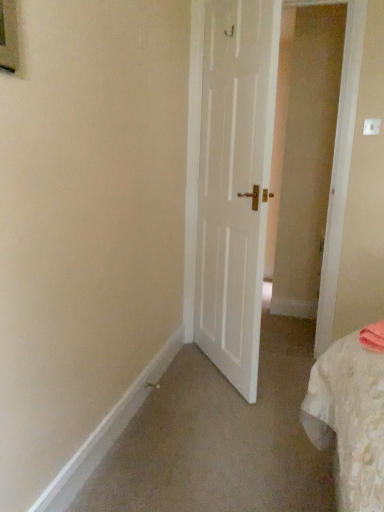
Describe the element at coordinates (371, 127) in the screenshot. The height and width of the screenshot is (512, 384). I see `white plastic electric outlet at upper right` at that location.

The image size is (384, 512). I want to click on white plastic electric outlet at upper right, so click(x=371, y=127).

At what (x,y) coordinates should I click in order to perform the action: click on white matte door at center. Please return your answer as a coordinate pair (x, y). Looking at the image, I should click on (235, 183).

What is the approximate height of white matte door at center?

6.59 feet.

The width and height of the screenshot is (384, 512). What do you see at coordinates (235, 183) in the screenshot?
I see `white matte door at center` at bounding box center [235, 183].

Locate an element on the screen. white plastic electric outlet at upper right is located at coordinates (371, 127).

Between white matte door at center and white plastic electric outlet at upper right, which one appears on the left side from the viewer's perspective?

Positioned to the left is white matte door at center.

From the picture: Considering the relative positions of white matte door at center and white plastic electric outlet at upper right in the image provided, is white matte door at center in front of white plastic electric outlet at upper right?

Yes, white matte door at center is closer to the camera.

Considering the points (261, 106) and (379, 127), which point is behind, point (261, 106) or point (379, 127)?

The point (379, 127) is more distant.

From the image's perspective, which object appears higher, white matte door at center or white plastic electric outlet at upper right?

white plastic electric outlet at upper right is shown above in the image.

From a real-world perspective, which is physically below, white matte door at center or white plastic electric outlet at upper right?

white matte door at center, from a real-world perspective.

Looking at their sizes, would you say white matte door at center is wider or thinner than white plastic electric outlet at upper right?

white matte door at center is wider than white plastic electric outlet at upper right.

Does white matte door at center have a lesser height compared to white plastic electric outlet at upper right?

No, white matte door at center is not shorter than white plastic electric outlet at upper right.

In terms of size, does white matte door at center appear bigger or smaller than white plastic electric outlet at upper right?

Clearly, white matte door at center is larger in size than white plastic electric outlet at upper right.

Is white plastic electric outlet at upper right completely or partially inside white matte door at center?

No, white matte door at center does not contain white plastic electric outlet at upper right.

Is white matte door at center with white plastic electric outlet at upper right?

No, white matte door at center is not making contact with white plastic electric outlet at upper right.

Is white matte door at center looking in the opposite direction of white plastic electric outlet at upper right?

That's right, white matte door at center is facing away from white plastic electric outlet at upper right.

Where is `electric outlet above the white matte door at center (from the image's perspective)`? electric outlet above the white matte door at center (from the image's perspective) is located at coordinates (371, 127).

Does white plastic electric outlet at upper right appear on the left side of white matte door at center?

In fact, white plastic electric outlet at upper right is to the right of white matte door at center.

Based on the photo, considering their positions, is white plastic electric outlet at upper right located in front of or behind white matte door at center?

white plastic electric outlet at upper right is behind white matte door at center.

Considering the positions of point (379, 129) and point (243, 66), is point (379, 129) closer or farther from the camera than point (243, 66)?

Point (379, 129) is farther from the camera than point (243, 66).

From the image's perspective, which is above, white plastic electric outlet at upper right or white matte door at center?

white plastic electric outlet at upper right is shown above in the image.

From a real-world perspective, is white plastic electric outlet at upper right physically located above or below white matte door at center?

From a real-world perspective, white plastic electric outlet at upper right is physically above white matte door at center.

Does white plastic electric outlet at upper right have a lesser width compared to white matte door at center?

Indeed, white plastic electric outlet at upper right has a lesser width compared to white matte door at center.

Is white plastic electric outlet at upper right shorter than white matte door at center?

Indeed, white plastic electric outlet at upper right has a lesser height compared to white matte door at center.

Considering the relative sizes of white plastic electric outlet at upper right and white matte door at center in the image provided, is white plastic electric outlet at upper right smaller than white matte door at center?

Yes.

Is white plastic electric outlet at upper right located outside white matte door at center?

Yes, white plastic electric outlet at upper right is located beyond the bounds of white matte door at center.

Are white plastic electric outlet at upper right and white matte door at center beside each other?

No, white plastic electric outlet at upper right is not touching white matte door at center.

Is white plastic electric outlet at upper right facing towards white matte door at center?

No, white plastic electric outlet at upper right is not oriented towards white matte door at center.

The width and height of the screenshot is (384, 512). In order to click on electric outlet on the right of white matte door at center in this screenshot , I will do `click(371, 127)`.

Where is `electric outlet located on the right of white matte door at center`? Image resolution: width=384 pixels, height=512 pixels. electric outlet located on the right of white matte door at center is located at coordinates (371, 127).

Where is `door below the white plastic electric outlet at upper right (from a real-world perspective)`? The image size is (384, 512). door below the white plastic electric outlet at upper right (from a real-world perspective) is located at coordinates (235, 183).